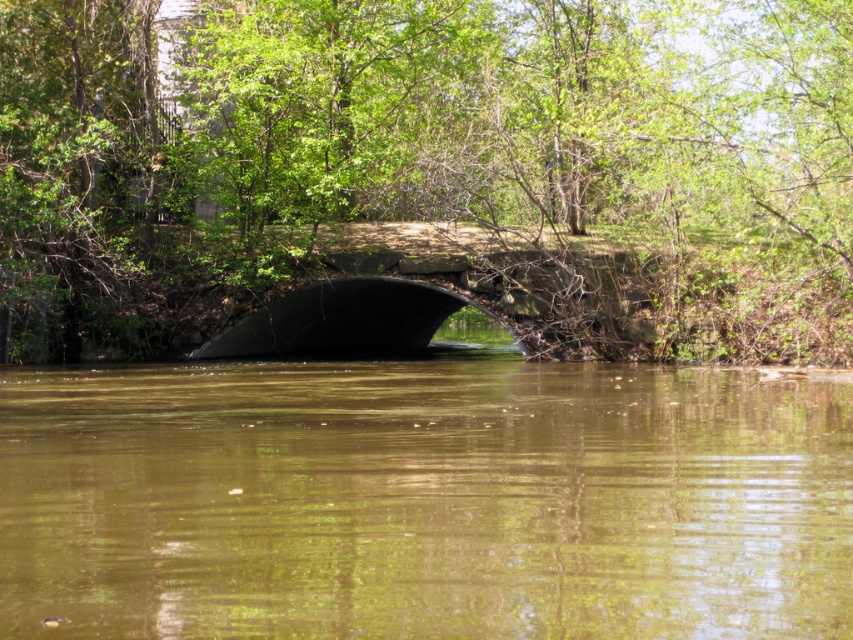
You are standing at point (430, 170) in the image. What object is located exactly at this point?

The point (430, 170) is occupied by the green leafy tree at center.

In the scene shown: You are standing at the stone bridge and want to know which point is closer to you. The points are point [113,29] and point [323,284]. Which point is closer to you?

Point [113,29] is closer to you because it is further to the viewer than point [323,284].

Looking at this image, you are standing at point (503,200) and want to cross the small stone bridge to reach the other side. The bridge is 137.26 feet long. If your walking speed is 3 feet per second, how many seconds will it take you to walk across the bridge?

The bridge is 137.26 feet long, and you walk at 3 feet per second. To calculate the time, divide the distance by the speed. 137.26 divided by 3 equals approximately 45.75 seconds. Therefore, it will take about 46 seconds to cross the bridge.